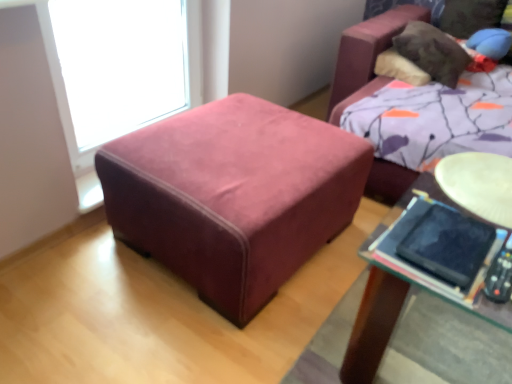
At what (x,y) coordinates should I click in order to perform the action: click on vacant space underneath black matte tablet at lower right (from a real-world perspective). Please return your answer as a coordinate pair (x, y). This screenshot has width=512, height=384. Looking at the image, I should click on (443, 240).